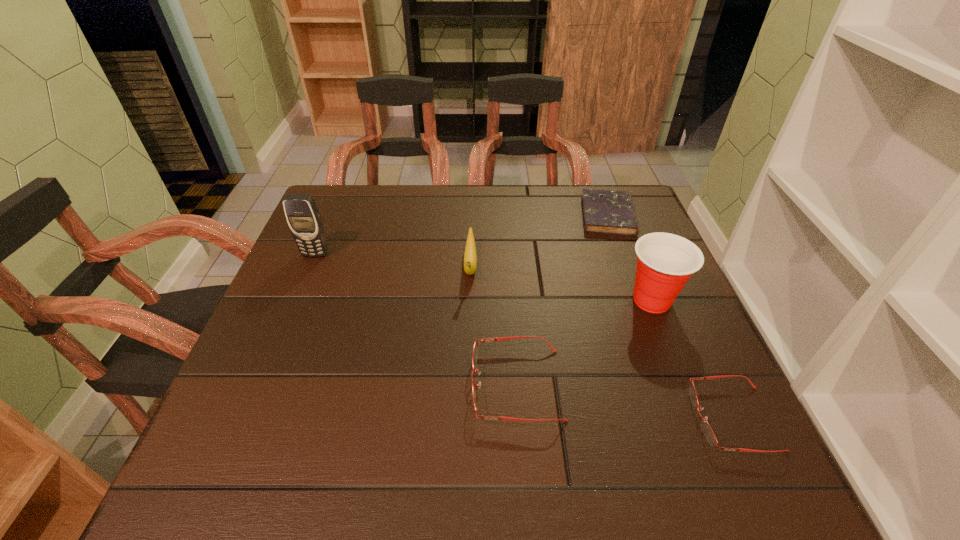
Locate an element on the screen. Image resolution: width=960 pixels, height=540 pixels. free space between the cellular telephone and the cup is located at coordinates (484, 277).

What are the coordinates of `free spot between the right spectacles and the banana` in the screenshot? It's located at (602, 342).

Locate an element on the screen. The width and height of the screenshot is (960, 540). vacant point located between the farthest object and the fourth tallest object is located at coordinates (563, 300).

What are the coordinates of `object that is the fifth closest one to the cellular telephone` in the screenshot? It's located at (707, 430).

Identify the location of the third closest object to the banana. (665, 261).

At what (x,y) coordinates should I click in order to perform the action: click on blank area in the image that satisfies the following two spatial constraints: 1. on the front side of the shortest object; 2. on the lenses of the taller spectacles. Please return your answer as a coordinate pair (x, y). This screenshot has height=540, width=960. Looking at the image, I should click on (670, 384).

At what (x,y) coordinates should I click in order to perform the action: click on vacant region that satisfies the following two spatial constraints: 1. on the front face of the cellular telephone; 2. on the right side of the second tallest object. Please return your answer as a coordinate pair (x, y). The image size is (960, 540). Looking at the image, I should click on (296, 300).

Locate an element on the screen. free space in the image that satisfies the following two spatial constraints: 1. at the stem of the fourth shortest object; 2. on the right side of the cup is located at coordinates (469, 300).

I want to click on free location that satisfies the following two spatial constraints: 1. at the stem of the third tallest object; 2. on the right side of the fifth shortest object, so click(469, 300).